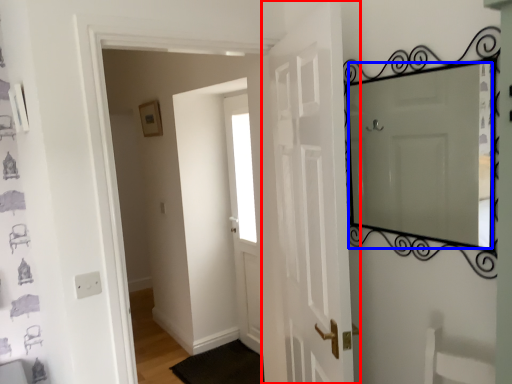
Question: Which object appears closest to the camera in this image, door (highlighted by a red box) or mirror (highlighted by a blue box)?

Choices:
 (A) door
 (B) mirror

Answer: (A)